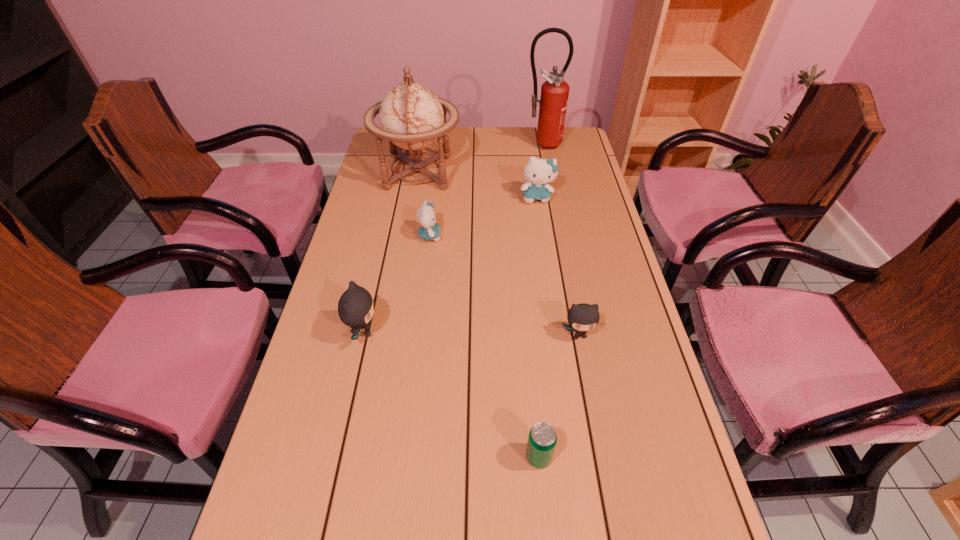
Locate an element on the screen. globe at the left edge is located at coordinates (412, 117).

This screenshot has height=540, width=960. Find the location of `kitten positioned at the left edge`. kitten positioned at the left edge is located at coordinates (355, 307).

At what (x,y) coordinates should I click in order to perform the action: click on fire extinguisher that is at the right edge. Please return your answer as a coordinate pair (x, y). Looking at the image, I should click on (553, 102).

At what (x,y) coordinates should I click in order to perform the action: click on object at the far left corner. Please return your answer as a coordinate pair (x, y). Looking at the image, I should click on (412, 117).

Locate an element on the screen. object located in the far right corner section of the desktop is located at coordinates (553, 102).

At what (x,y) coordinates should I click in order to perform the action: click on free space at the far edge. Please return your answer as a coordinate pair (x, y). Image resolution: width=960 pixels, height=540 pixels. Looking at the image, I should click on (457, 132).

Identify the location of blank space at the left edge of the desktop. The width and height of the screenshot is (960, 540). (375, 214).

Where is `free region at the right edge of the desktop`? This screenshot has width=960, height=540. free region at the right edge of the desktop is located at coordinates (633, 443).

Where is `free space that is in between the fire extinguisher and the right gray kitten`? The height and width of the screenshot is (540, 960). free space that is in between the fire extinguisher and the right gray kitten is located at coordinates (561, 240).

What are the coordinates of `empty space that is in between the globe and the smaller gray kitten` in the screenshot? It's located at (498, 254).